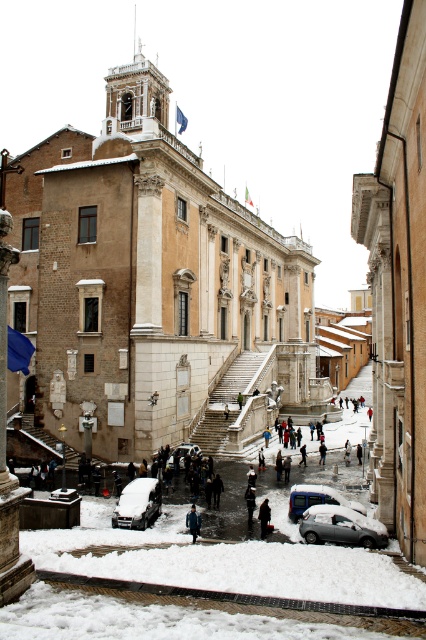
Can you confirm if sleek silver sedan at center is positioned above dark gray fabric coat at lower center?

Yes, sleek silver sedan at center is above dark gray fabric coat at lower center.

Which is below, sleek silver sedan at center or dark gray fabric coat at lower center?

dark gray fabric coat at lower center is lower down.

Is point (134, 520) closer to camera compared to point (261, 538)?

Yes, it is.

Image resolution: width=426 pixels, height=640 pixels. What are the coordinates of `sleek silver sedan at center` in the screenshot? It's located at point(138,502).

Measure the distance between point [244,371] and camera.

Point [244,371] is 92.27 meters from camera.

Between white marble stairs at center and blue denim jacket at center, which one appears on the left side from the viewer's perspective?

Positioned to the left is blue denim jacket at center.

This screenshot has width=426, height=640. Identify the location of white marble stairs at center. (224, 403).

Which is above, silver metallic car at lower center or metallic silver car at center?

Positioned higher is silver metallic car at lower center.

Who is positioned more to the left, silver metallic car at lower center or metallic silver car at center?

silver metallic car at lower center is more to the left.

Which is in front, point (377, 541) or point (337, 502)?

Point (377, 541)

Locate an element on the screen. The width and height of the screenshot is (426, 640). silver metallic car at lower center is located at coordinates (340, 525).